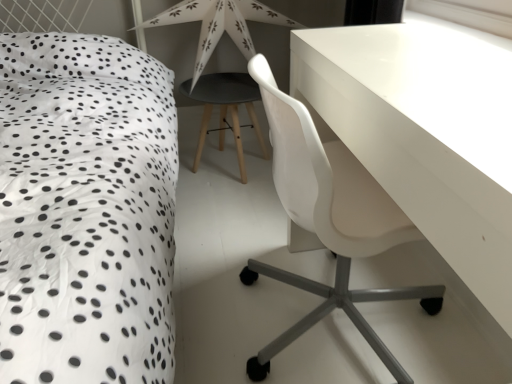
Question: Is white paper star at upper center to the left or to the right of transparent plastic window screen at upper right in the image?

Choices:
 (A) right
 (B) left

Answer: (B)

Question: From the image's perspective, is white paper star at upper center located above or below transparent plastic window screen at upper right?

Choices:
 (A) above
 (B) below

Answer: (A)

Question: Which object is positioned farthest from the white glossy table at upper right?

Choices:
 (A) white paper star at upper center
 (B) matte black stool at center
 (C) white dotted fabric at left
 (D) transparent plastic window screen at upper right

Answer: (A)

Question: Estimate the real-world distances between objects in this image. Which object is closer to the white paper star at upper center?

Choices:
 (A) white glossy table at upper right
 (B) transparent plastic window screen at upper right
 (C) white dotted fabric at left
 (D) matte black stool at center

Answer: (D)